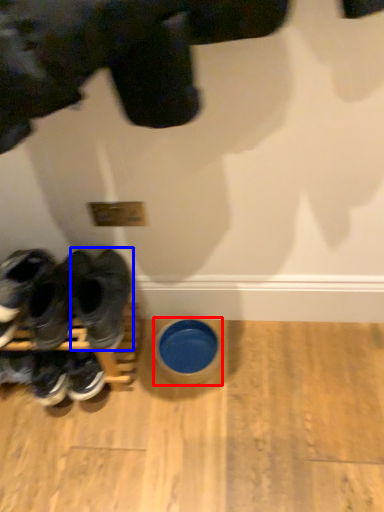
Question: Which object is closer to the camera taking this photo, bowl (highlighted by a red box) or footwear (highlighted by a blue box)?

Choices:
 (A) bowl
 (B) footwear

Answer: (B)